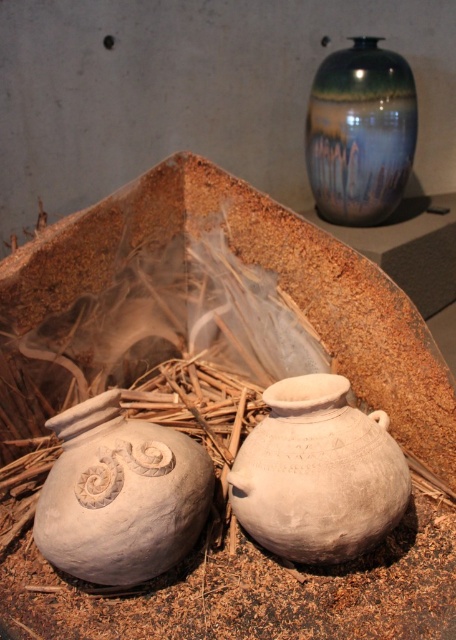
You are an archaeologist examining the display setup. You need to document the positions of the white matte clay pot at center and the shiny ceramic vase at upper right. Which object is positioned to the left of the other?

The white matte clay pot at center is positioned to the left of the shiny ceramic vase at upper right.

You are an archaeologist examining the display setup. You notice a point marked at coordinates (317, 474). What object is located at this point?

The white matte clay pot at center is located at point (317, 474).

You are an archaeologist examining the display setup. You need to reach the white clay pot at lower left and the white matte clay pot at center. Which one should you approach first to touch the closest one?

The white clay pot at lower left is closer to the viewer, so you should approach it first to touch the closest one.